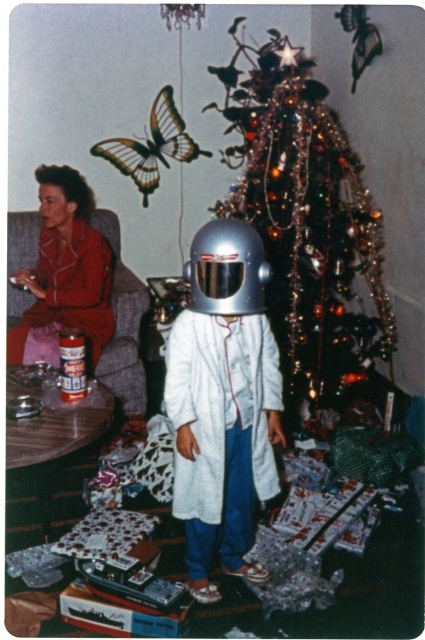
Question: Which object appears farthest from the camera in this image?

Choices:
 (A) shiny metallic tree at center
 (B) shiny silver helmet at center
 (C) shiny metallic helmet at center

Answer: (A)

Question: Among these points, which one is nearest to the camera?

Choices:
 (A) click(x=269, y=188)
 (B) click(x=229, y=236)

Answer: (B)

Question: Can you confirm if shiny silver helmet at center is wider than matte red pajamas at left?

Choices:
 (A) no
 (B) yes

Answer: (A)

Question: Considering the real-world distances, which object is closest to the shiny metallic helmet at center?

Choices:
 (A) shiny silver helmet at center
 (B) matte red pajamas at left

Answer: (A)

Question: Can you confirm if shiny silver helmet at center is bigger than shiny metallic helmet at center?

Choices:
 (A) yes
 (B) no

Answer: (A)

Question: Is matte red pajamas at left to the right of shiny metallic helmet at center from the viewer's perspective?

Choices:
 (A) no
 (B) yes

Answer: (A)